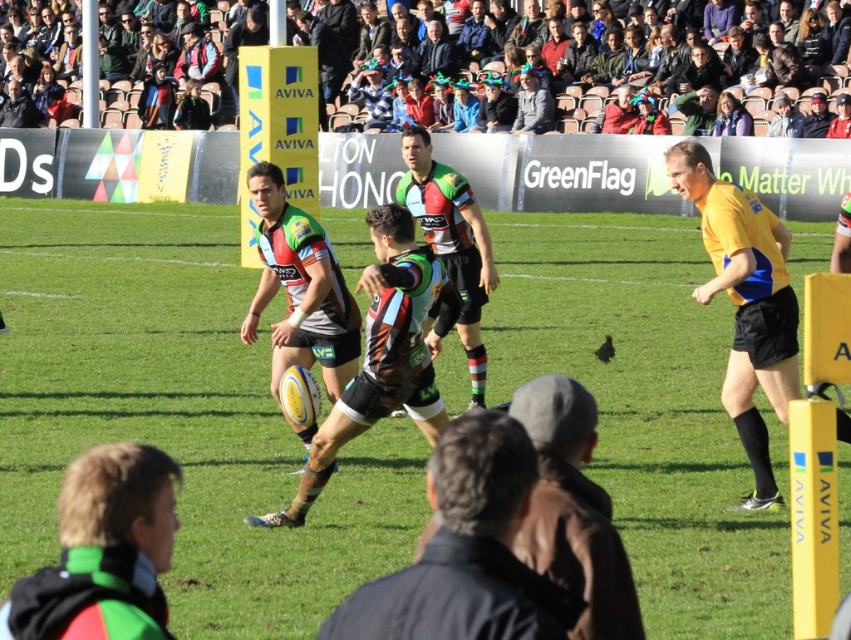
You are a spectator at the rugby match and want to know which of the two green items, the green fabric jacket at lower left or the green jersey at center, is shorter in height. Can you tell me?

The green fabric jacket at lower left has a lesser height compared to the green jersey at center, so the green fabric jacket at lower left is shorter in height.

Based on the photo, you are a spectator at the rugby match and want to take a photo of the green fabric jacket at lower left and the camouflage jersey at center. Which object should you zoom in on first if you want to capture both in the frame without moving the camera?

The green fabric jacket at lower left is not as tall as the camouflage jersey at center, so you should zoom in on the camouflage jersey at center first to ensure it fits in the frame while still capturing the smaller green fabric jacket at lower left.

From the picture: You are a photographer at the rugby match and want to capture a closeup of the green fabric jacket at lower left and the camouflage jersey at center. Which object should you zoom in on to ensure both are in frame without moving the camera?

The green fabric jacket at lower left occupies less space than the camouflage jersey at center, so you should zoom in on the larger camouflage jersey at center to include both objects in the frame.